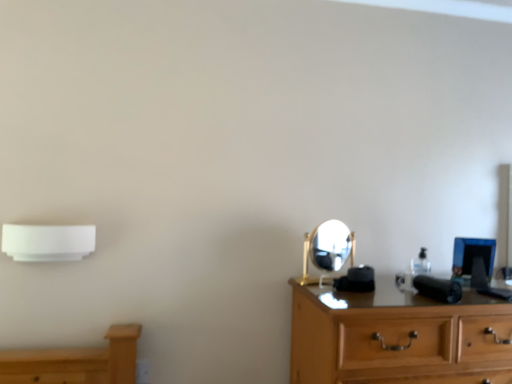
Question: Do you think wooden chest of drawers at right is within gold metallic mirror at center, or outside of it?

Choices:
 (A) outside
 (B) inside

Answer: (A)

Question: Considering the relative positions of wooden chest of drawers at right and gold metallic mirror at center in the image provided, is wooden chest of drawers at right to the left or to the right of gold metallic mirror at center?

Choices:
 (A) right
 (B) left

Answer: (A)

Question: Based on their relative distances, which object is farther from the white plastic air conditioner at left?

Choices:
 (A) white plastic electric outlet at lower left
 (B) gold metallic mirror at center
 (C) wooden chest of drawers at right

Answer: (C)

Question: Which object is the closest to the white plastic electric outlet at lower left?

Choices:
 (A) gold metallic mirror at center
 (B) wooden chest of drawers at right
 (C) white plastic air conditioner at left

Answer: (C)